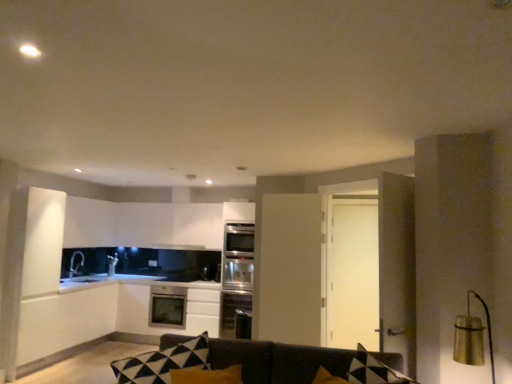
Question: Is point (177, 246) closer or farther from the camera than point (251, 231)?

Choices:
 (A) farther
 (B) closer

Answer: (B)

Question: From the image's perspective, is black matte exhaust hood at upper center positioned above or below satin silver oven at center?

Choices:
 (A) above
 (B) below

Answer: (A)

Question: Estimate the real-world distances between objects in this image. Which object is farther from the black matte exhaust hood at upper center?

Choices:
 (A) dark gray fabric couch at center
 (B) satin silver oven at center
 (C) satin silver dishwasher at center
 (D) satin black microwave at center
 (E) satin white oven at center

Answer: (A)

Question: Which object is positioned farthest from the satin silver oven at center?

Choices:
 (A) black matte exhaust hood at upper center
 (B) satin white oven at center
 (C) satin black microwave at center
 (D) dark gray fabric couch at center
 (E) satin silver dishwasher at center

Answer: (D)